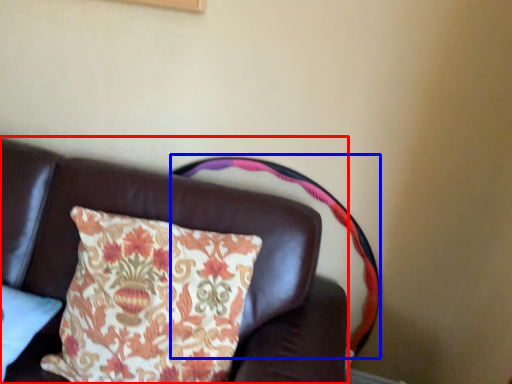
Question: Among these objects, which one is nearest to the camera, furniture (highlighted by a red box) or swivel chair (highlighted by a blue box)?

Choices:
 (A) furniture
 (B) swivel chair

Answer: (A)